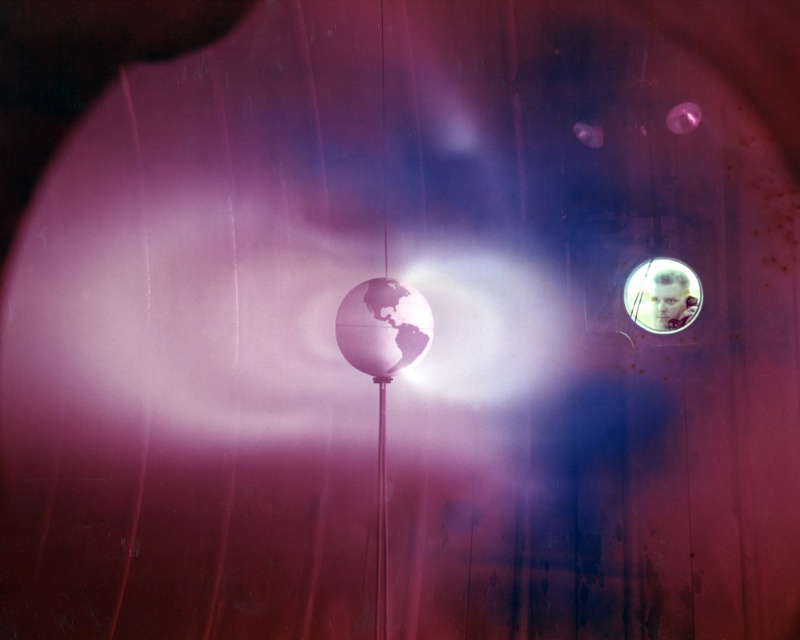
The width and height of the screenshot is (800, 640). I want to click on translucent plastic bubble at upper right, so click(662, 296).

Is translucent plastic bubble at upper right further to the viewer compared to metallic pole at center?

Yes, it is behind metallic pole at center.

Describe the element at coordinates (662, 296) in the screenshot. I see `translucent plastic bubble at upper right` at that location.

Locate an element on the screen. translucent plastic bubble at upper right is located at coordinates (662, 296).

Is matte metallic globe at center smaller than translucent plastic bubble at upper right?

Actually, matte metallic globe at center might be larger than translucent plastic bubble at upper right.

Does point (338, 339) lie in front of point (646, 260)?

Yes, point (338, 339) is in front of point (646, 260).

Which is in front, point (356, 353) or point (676, 289)?

Point (356, 353) is more forward.

Locate an element on the screen. This screenshot has height=640, width=800. matte metallic globe at center is located at coordinates (382, 326).

What do you see at coordinates (382, 326) in the screenshot? Image resolution: width=800 pixels, height=640 pixels. I see `matte metallic globe at center` at bounding box center [382, 326].

Who is lower down, matte metallic globe at center or metallic pole at center?

Positioned lower is metallic pole at center.

This screenshot has width=800, height=640. What do you see at coordinates (382, 326) in the screenshot?
I see `matte metallic globe at center` at bounding box center [382, 326].

Locate an element on the screen. The image size is (800, 640). matte metallic globe at center is located at coordinates (382, 326).